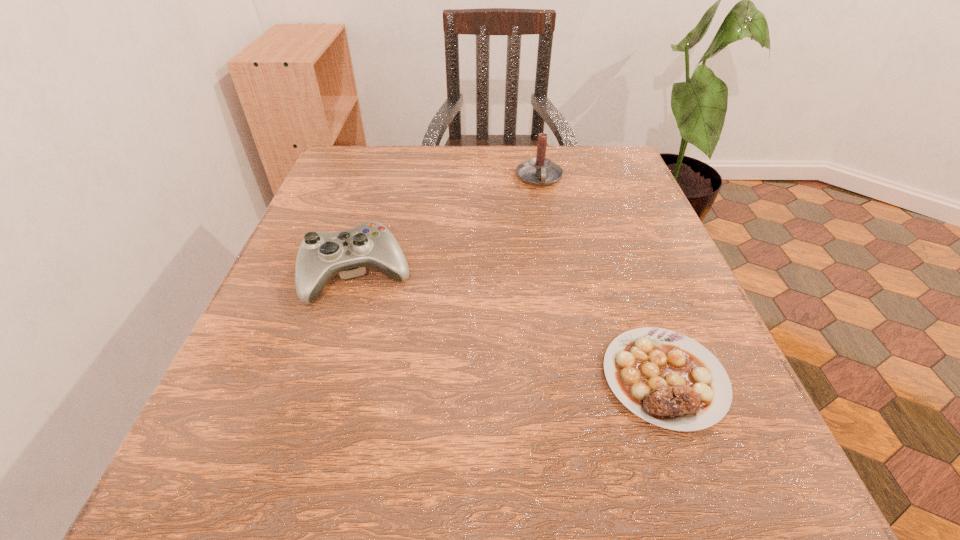
Identify the location of candle. pyautogui.click(x=539, y=171).

Find the location of a particular element. the tallest object is located at coordinates (539, 171).

This screenshot has width=960, height=540. Identify the location of the second farthest object. (321, 255).

At what (x,y) coordinates should I click in order to perform the action: click on control. Please return your answer as a coordinate pair (x, y). The height and width of the screenshot is (540, 960). Looking at the image, I should click on (321, 255).

You are a GUI agent. You are given a task and a screenshot of the screen. Output one action in this format:
    pyautogui.click(x=<x>, y=<y>)
    Task: Click on the nearest object
    Image resolution: width=960 pixels, height=540 pixels.
    Given the screenshot: What is the action you would take?
    pyautogui.click(x=664, y=377)

Locate an element on the screen. the shortest object is located at coordinates (664, 377).

This screenshot has width=960, height=540. I want to click on vacant point located 0.310m on the side of the tallest object with the handle loop, so click(x=561, y=291).

You are a GUI agent. You are given a task and a screenshot of the screen. Output one action in this format:
    pyautogui.click(x=<x>, y=<y>)
    Task: Click on the vacant space located 0.400m on the right of the control
    This screenshot has width=960, height=540.
    Given the screenshot: What is the action you would take?
    pyautogui.click(x=637, y=275)

At what (x,y) coordinates should I click in order to perform the action: click on vacant space located 0.330m on the left of the steak. Please return your answer as a coordinate pair (x, y). This screenshot has width=960, height=540. Looking at the image, I should click on (371, 378).

Locate an element on the screen. The image size is (960, 540). object that is at the far edge is located at coordinates (539, 171).